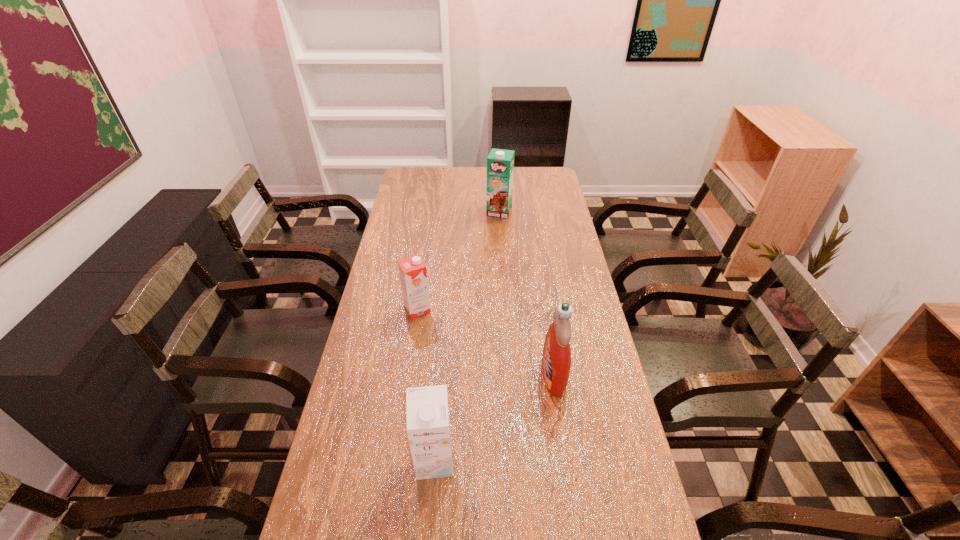
Locate an element on the screen. Image resolution: width=960 pixels, height=540 pixels. free location located on the front surface of the detergent is located at coordinates (471, 375).

The image size is (960, 540). I want to click on vacant area situated 0.390m on the front surface of the detergent, so click(405, 375).

Identify the location of vacant region located on the left of the nearest object. The height and width of the screenshot is (540, 960). (337, 461).

You are a GUI agent. You are given a task and a screenshot of the screen. Output one action in this format:
    pyautogui.click(x=<x>, y=<y>)
    Task: Click on the free location located 0.120m on the back of the second farthest carton
    The height and width of the screenshot is (540, 960).
    Given the screenshot: What is the action you would take?
    pyautogui.click(x=422, y=276)

Image resolution: width=960 pixels, height=540 pixels. Identify the location of object positioned at the left edge. (413, 275).

Where is `object that is at the right edge`? The image size is (960, 540). object that is at the right edge is located at coordinates (556, 360).

Locate an element on the screen. This screenshot has width=960, height=540. free space at the far edge of the desktop is located at coordinates (452, 191).

At what (x,y) coordinates should I click in order to perform the action: click on vacant space at the left edge. Please return your answer as a coordinate pair (x, y). The width and height of the screenshot is (960, 540). Looking at the image, I should click on (407, 246).

The width and height of the screenshot is (960, 540). Identify the location of free point at the right edge. (559, 287).

Locate an element on the screen. The width and height of the screenshot is (960, 540). free spot at the far left corner of the desktop is located at coordinates (434, 191).